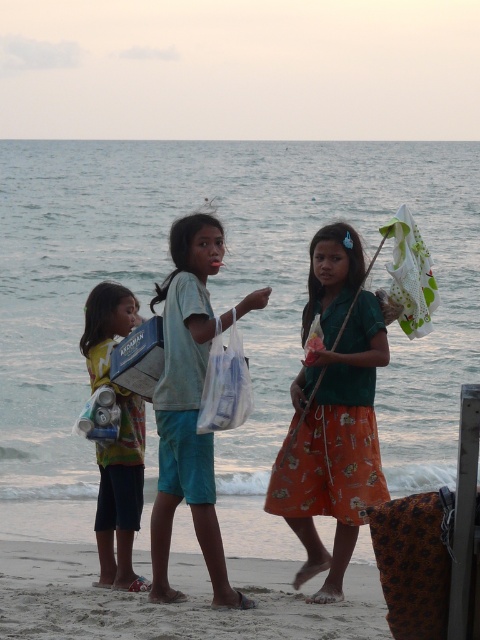
Question: Based on their relative distances, which object is farther from the sandy beach at lower center?

Choices:
 (A) translucent plastic bag at center
 (B) multicolored fabric bag at left

Answer: (A)

Question: Which point is closer to the camera?

Choices:
 (A) green cotton shirt at center
 (B) translucent plastic bag at center
 (C) light blue shorts at center
 (D) sandy beach at lower center

Answer: (D)

Question: Is sandy beach at lower center in front of translucent plastic bag at center?

Choices:
 (A) no
 (B) yes

Answer: (B)

Question: From the image, what is the correct spatial relationship of sandy beach at lower center in relation to multicolored fabric bag at left?

Choices:
 (A) left
 (B) right

Answer: (A)

Question: Is light blue shorts at center positioned behind translucent plastic bag at center?

Choices:
 (A) yes
 (B) no

Answer: (B)

Question: Which is farther from the green cotton shirt at center?

Choices:
 (A) sandy beach at lower center
 (B) light blue shorts at center
 (C) translucent plastic bag at center
 (D) multicolored fabric bag at left

Answer: (A)